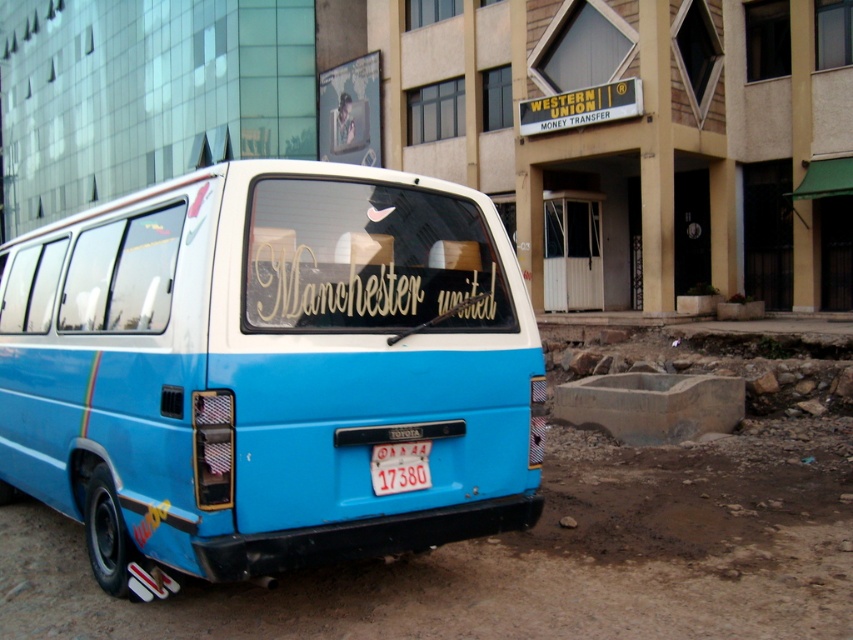
Question: Can you confirm if blue matte van at center is positioned to the left of gold metallic manchester united at center?

Choices:
 (A) no
 (B) yes

Answer: (B)

Question: Does blue matte van at center appear on the left side of gold metallic manchester united at center?

Choices:
 (A) yes
 (B) no

Answer: (A)

Question: Which point appears farthest from the camera in this image?

Choices:
 (A) (413, 310)
 (B) (404, 458)
 (C) (434, 468)

Answer: (C)

Question: Can you confirm if blue matte van at center is positioned below white plastic license plate at center?

Choices:
 (A) yes
 (B) no

Answer: (A)

Question: Which object is closer to the camera taking this photo?

Choices:
 (A) blue matte van at center
 (B) gold metallic manchester united at center
 (C) white plastic license plate at center

Answer: (B)

Question: Which point appears farthest from the camera in this image?

Choices:
 (A) (387, 451)
 (B) (466, 244)
 (C) (469, 253)

Answer: (C)